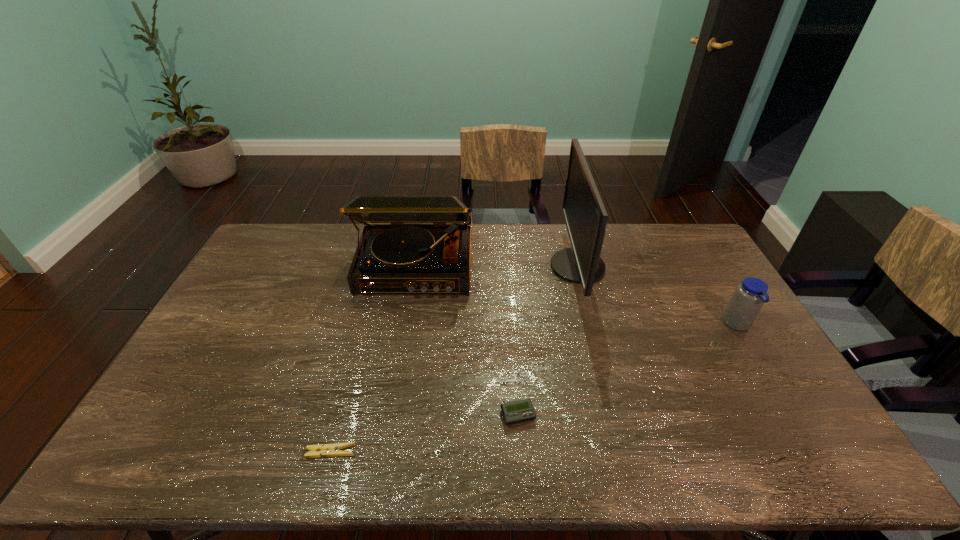
The width and height of the screenshot is (960, 540). Find the location of `free space between the monitor and the water bottle`. free space between the monitor and the water bottle is located at coordinates (658, 295).

Find the location of a particular element. This screenshot has width=960, height=540. free space between the nearest object and the water bottle is located at coordinates (534, 388).

Locate an element on the screen. free spot between the clothespin and the second nearest object is located at coordinates (424, 434).

Find the location of a particular element. This screenshot has height=540, width=960. unoccupied area between the fourth object from left to right and the beeper is located at coordinates (548, 341).

The width and height of the screenshot is (960, 540). I want to click on unoccupied area between the monitor and the beeper, so click(x=548, y=341).

The image size is (960, 540). What are the coordinates of `empty space between the shortest object and the water bottle` in the screenshot? It's located at (534, 388).

Find the location of `empty space between the beeper and the monitor`. empty space between the beeper and the monitor is located at coordinates (548, 341).

The image size is (960, 540). Identify the location of free area in between the water bottle and the second nearest object. 628,370.

Identify the location of object that is the closest to the second nearest object. (585, 216).

Identify which object is located as the third nearest to the rightmost object. Please provide its 2D coordinates. Your answer should be formatted as a tuple, i.e. [(x, y)], where the tuple contains the x and y coordinates of a point satisfying the conditions above.

[(410, 244)]